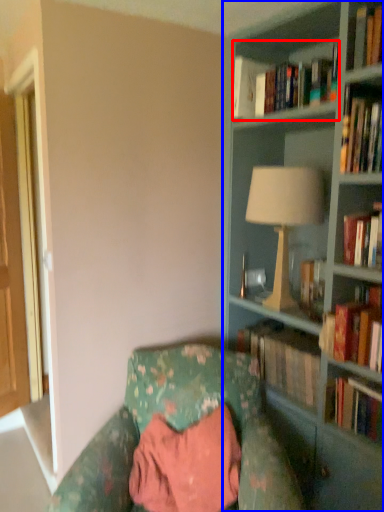
Question: Which of the following is the farthest to the observer, book (highlighted by a red box) or bookcase (highlighted by a blue box)?

Choices:
 (A) book
 (B) bookcase

Answer: (A)